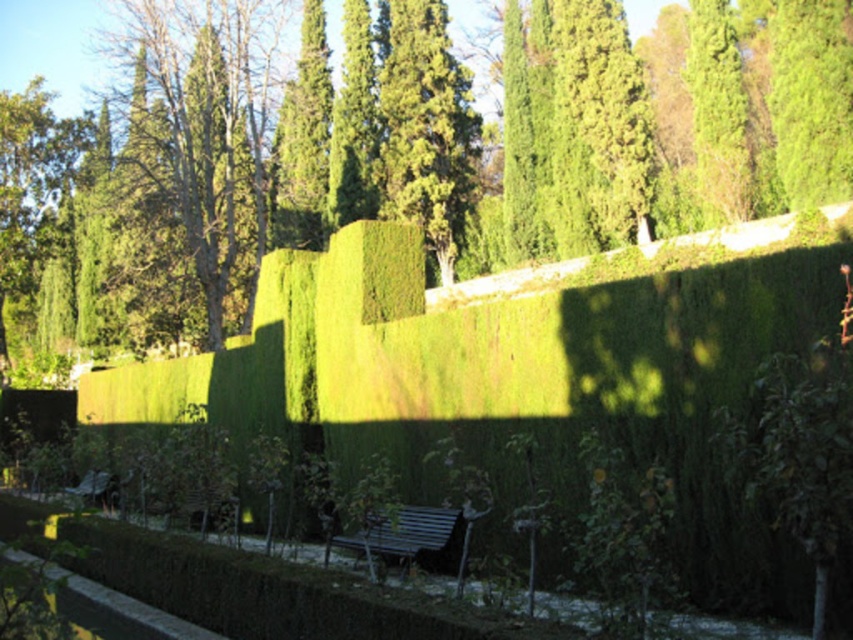
Question: Which object is positioned closest to the wooden park bench at lower left?

Choices:
 (A) green leafy tree at center
 (B) metallic blue bench at center

Answer: (B)

Question: Is green leafy tree at center above wooden park bench at lower left?

Choices:
 (A) yes
 (B) no

Answer: (A)

Question: Is green leafy tree at center to the right of wooden park bench at lower left from the viewer's perspective?

Choices:
 (A) yes
 (B) no

Answer: (A)

Question: Which of the following is the closest to the observer?

Choices:
 (A) (453, 164)
 (B) (328, 541)

Answer: (B)

Question: Can you confirm if green leafy tree at center is positioned to the left of wooden park bench at lower left?

Choices:
 (A) no
 (B) yes

Answer: (A)

Question: Which object appears farthest from the camera in this image?

Choices:
 (A) wooden park bench at lower left
 (B) metallic blue bench at center
 (C) green leafy tree at center

Answer: (C)